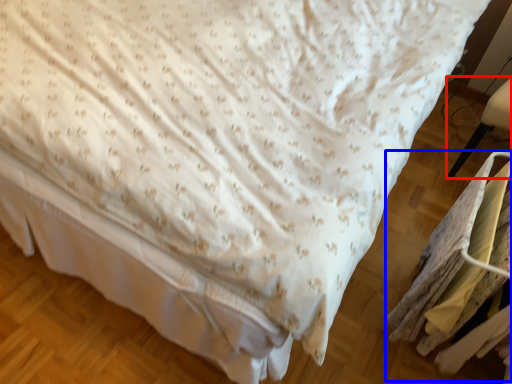
Question: Which object appears closest to the camera in this image, furniture (highlighted by a red box) or laundry (highlighted by a blue box)?

Choices:
 (A) furniture
 (B) laundry

Answer: (B)